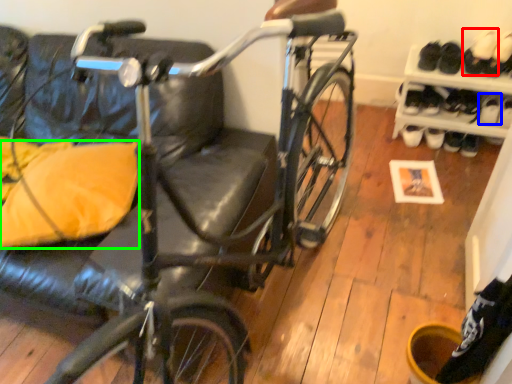
Question: Which is nearer to the footwear (highlighted by a red box)? shoe (highlighted by a blue box) or pillow (highlighted by a green box).

Choices:
 (A) shoe
 (B) pillow

Answer: (A)